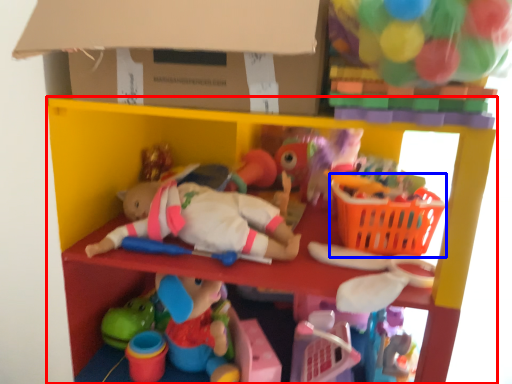
Question: Among these objects, which one is nearest to the camera, shelf (highlighted by a red box) or basket (highlighted by a blue box)?

Choices:
 (A) shelf
 (B) basket

Answer: (A)